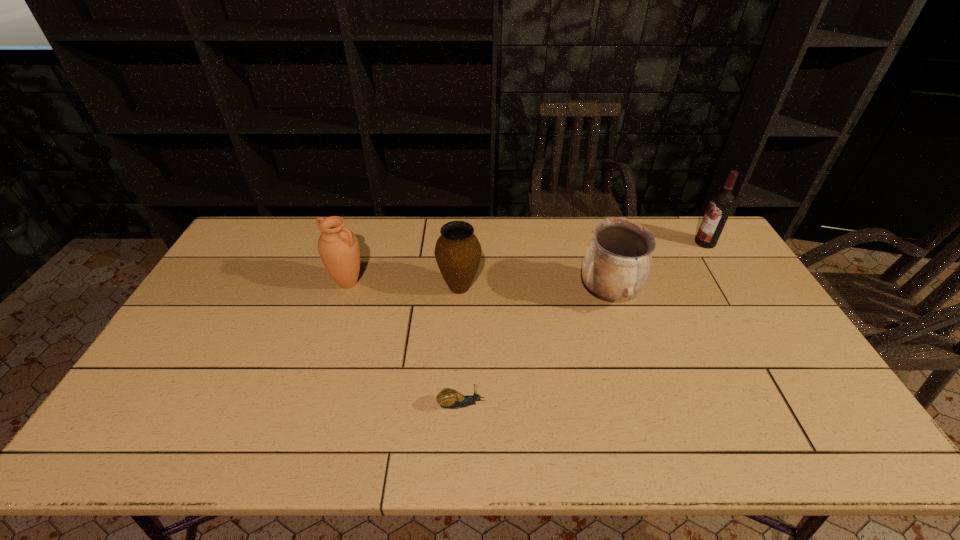
At what (x,y) coordinates should I click in order to perform the action: click on empty space between the leftmost urn and the nearest object. Please return your answer as a coordinate pair (x, y). Looking at the image, I should click on (404, 343).

This screenshot has width=960, height=540. In order to click on vacant space that is in between the escargot and the leftmost urn in this screenshot , I will do `click(404, 343)`.

Where is `free space between the second urn from left to right and the farthest object`? free space between the second urn from left to right and the farthest object is located at coordinates (583, 265).

Locate an element on the screen. free space between the leftmost object and the escargot is located at coordinates (404, 343).

What are the coordinates of `vacant point located between the leftmost object and the second urn from left to right` in the screenshot? It's located at (404, 285).

At what (x,y) coordinates should I click in order to perform the action: click on free spot between the wine bottle and the fourth object from left to right. Please return your answer as a coordinate pair (x, y). Looking at the image, I should click on (657, 268).

I want to click on free space between the fourth object from left to right and the nearest object, so click(x=535, y=349).

At what (x,y) coordinates should I click in order to perform the action: click on free space that is in between the wine bottle and the leftmost urn. Please return your answer as a coordinate pair (x, y). This screenshot has width=960, height=540. Looking at the image, I should click on (527, 263).

Where is `free space that is in between the leftmost urn and the shortest object`? Image resolution: width=960 pixels, height=540 pixels. free space that is in between the leftmost urn and the shortest object is located at coordinates (404, 343).

I want to click on vacant area that lies between the shortest object and the second object from right to left, so click(x=535, y=349).